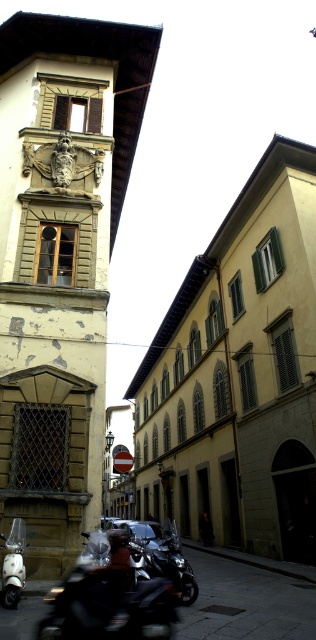
Question: Which object is positioned closest to the metallic silver scooter at lower left?

Choices:
 (A) shiny black motorcycle at lower left
 (B) yellowish stone tower at center

Answer: (A)

Question: Which object is closer to the camera taking this photo?

Choices:
 (A) yellowish stone tower at center
 (B) shiny black motorcycle at lower left

Answer: (B)

Question: Is yellowish stone tower at center thinner than metallic silver scooter at lower left?

Choices:
 (A) no
 (B) yes

Answer: (A)

Question: Can you confirm if yellowish stone tower at center is positioned below metallic silver scooter at lower left?

Choices:
 (A) yes
 (B) no

Answer: (B)

Question: Can you confirm if yellowish stone tower at center is bigger than metallic silver scooter at lower left?

Choices:
 (A) no
 (B) yes

Answer: (B)

Question: Among these points, which one is farthest from the camera?

Choices:
 (A) (46, 304)
 (B) (18, 538)

Answer: (A)